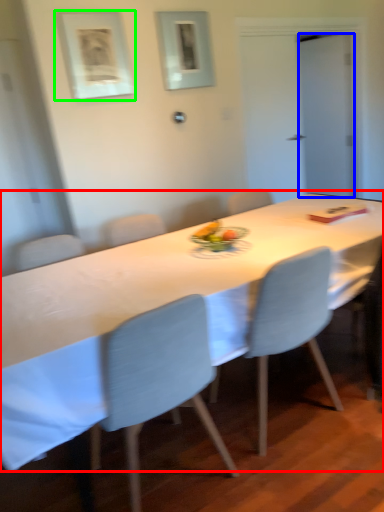
Question: Which is nearer to the table (highlighted by a red box)? glass door (highlighted by a blue box) or picture frame (highlighted by a green box).

Choices:
 (A) glass door
 (B) picture frame

Answer: (B)